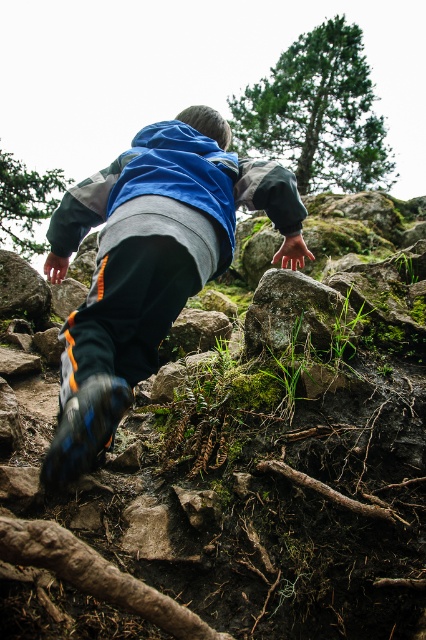
You are a hiker trying to navigate through the rocky terrain. You notice the mossy rock at center and the matte blue jacket at center. Which object is taller from your viewpoint?

The mossy rock at center has a lesser height compared to the matte blue jacket at center, so the matte blue jacket at center is taller.

You are a hiker trying to navigate through the rocky terrain. You notice the matte blue jacket at center and the rough textured rock at center. Which object is located to the right side of the other?

The rough textured rock at center is located to the right side of the matte blue jacket at center because the matte blue jacket at center is positioned on the left side of the rough textured rock at center.